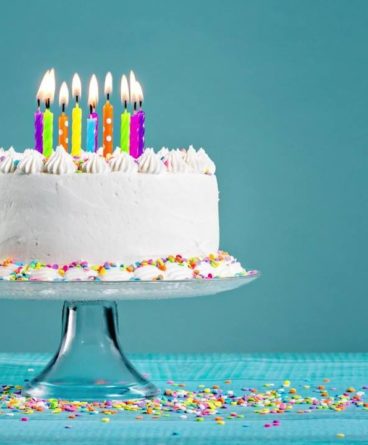
The width and height of the screenshot is (368, 445). I want to click on candle flames, so click(49, 86), click(41, 89), click(63, 96), click(77, 87), click(95, 96), click(106, 86), click(121, 91), click(134, 94), click(140, 94).